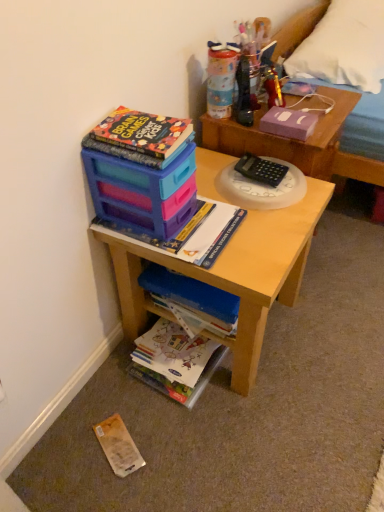
The width and height of the screenshot is (384, 512). I want to click on vacant space that's between matte plastic desk at center and colored paper art at lower center, arranged as the 1th book when ordered from the bottom, so click(188, 398).